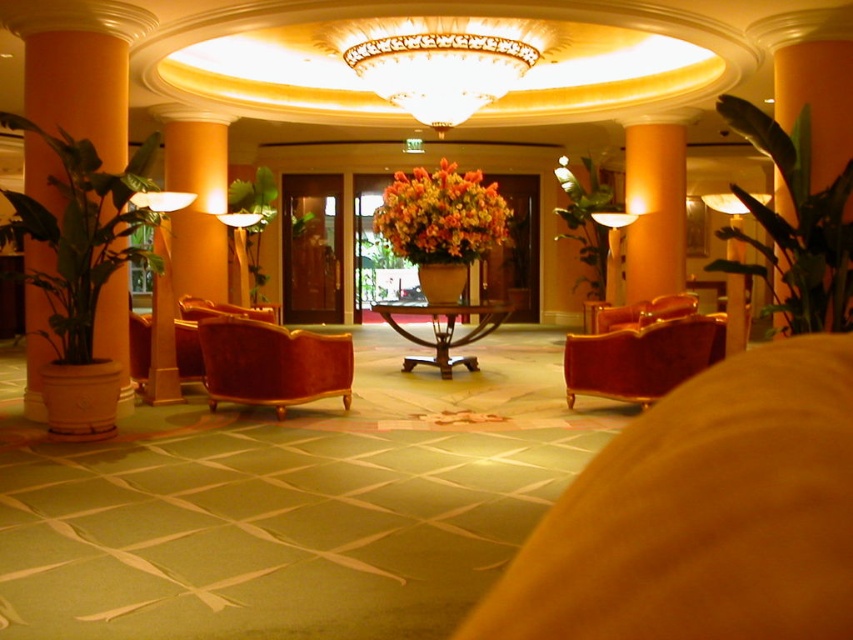
Question: Which of these objects is positioned farthest from the matte gold lamp at center?

Choices:
 (A) orange glossy pillar at center
 (B) orange textured bouquet at center
 (C) velvet red armchair at center
 (D) velvet armchair at center

Answer: (A)

Question: Estimate the real-world distances between objects in this image. Which object is closer to the illuminated glass chandelier at upper center?

Choices:
 (A) orange textured bouquet at center
 (B) velvet red chair at center
 (C) velvet red armchair at center

Answer: (A)

Question: Which of the following is the farthest from the observer?

Choices:
 (A) orange glossy pillar at center
 (B) matte white lampshade at left
 (C) velvet armchair at center

Answer: (A)

Question: Does green leafy plant at center appear over velvet red armchair at center?

Choices:
 (A) no
 (B) yes

Answer: (B)

Question: Does velvet red chair at center have a larger size compared to green leafy plant at left?

Choices:
 (A) no
 (B) yes

Answer: (A)

Question: Can you confirm if orange textured bouquet at center is positioned to the right of velvet red armchair at center?

Choices:
 (A) yes
 (B) no

Answer: (B)